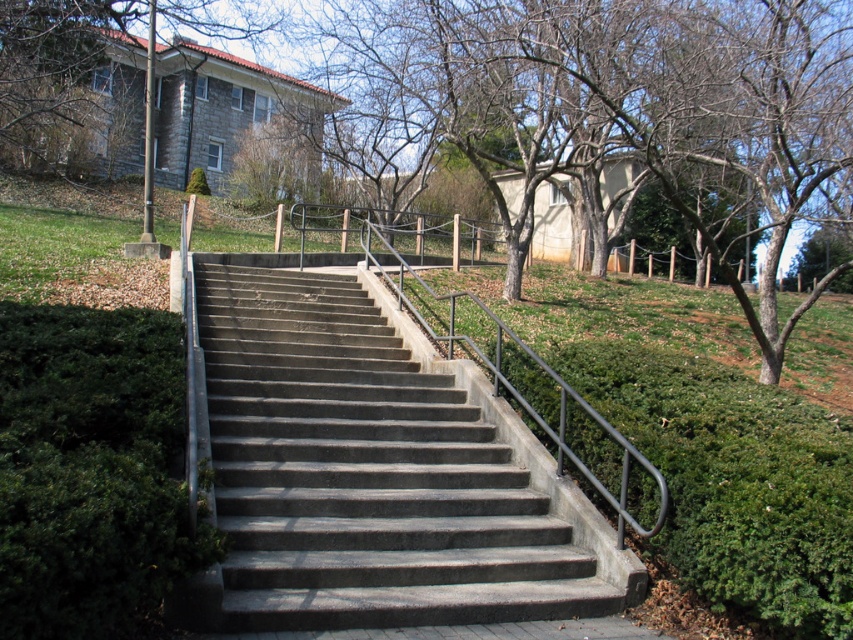
Is green leafy bush at lower left to the right of green stone building at upper left from the viewer's perspective?

Correct, you'll find green leafy bush at lower left to the right of green stone building at upper left.

Between point (24, 337) and point (62, 97), which one is positioned behind?

Point (62, 97)

At what (x,y) coordinates should I click in order to perform the action: click on green leafy bush at lower left. Please return your answer as a coordinate pair (x, y). The width and height of the screenshot is (853, 640). Looking at the image, I should click on (91, 470).

Does point (317, 342) come closer to viewer compared to point (273, 17)?

Yes, point (317, 342) is closer to viewer.

Can you confirm if concrete/steps at center is positioned below green stone building at upper left?

Correct, concrete/steps at center is located below green stone building at upper left.

The image size is (853, 640). I want to click on concrete/steps at center, so click(x=374, y=477).

The height and width of the screenshot is (640, 853). In order to click on concrete/steps at center in this screenshot , I will do `click(374, 477)`.

Does concrete/steps at center appear on the right side of bare branches at center?

Incorrect, concrete/steps at center is not on the right side of bare branches at center.

This screenshot has height=640, width=853. What are the coordinates of `concrete/steps at center` in the screenshot? It's located at (374, 477).

Is point (514, 531) farther from viewer compared to point (577, 32)?

That is False.

Image resolution: width=853 pixels, height=640 pixels. Identify the location of concrete/steps at center. (374, 477).